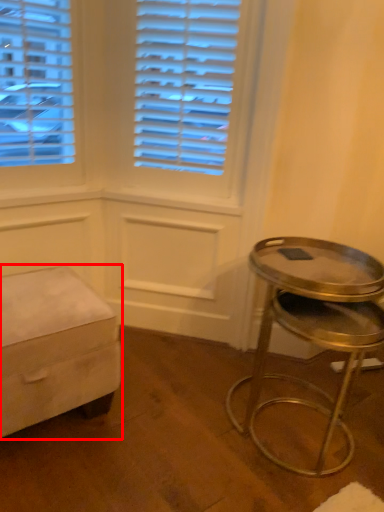
Question: Where is furniture (annotated by the red box) located in relation to stool in the image?

Choices:
 (A) right
 (B) left

Answer: (B)